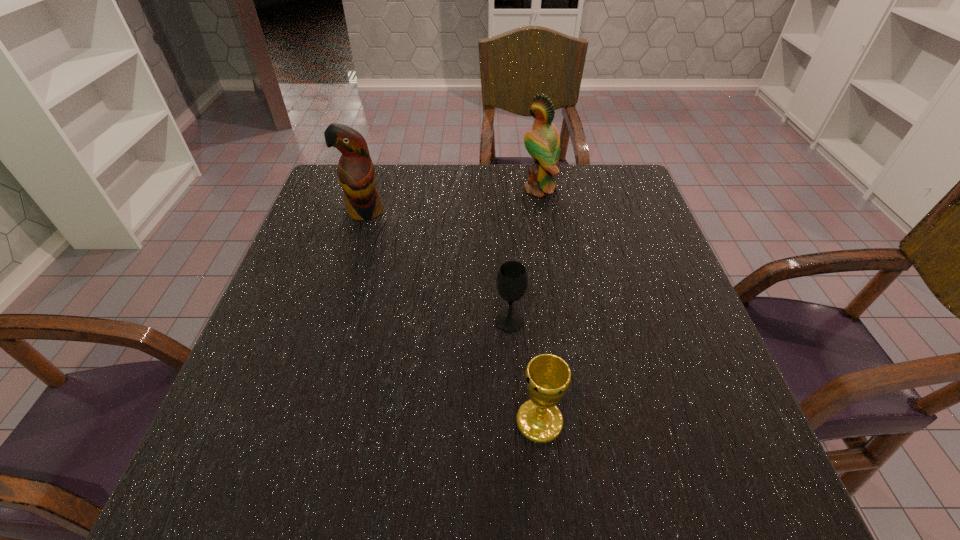
Find the location of a particular element. This screenshot has width=960, height=540. object that is positioned at the left edge is located at coordinates (356, 174).

Where is `object present at the far left corner`? object present at the far left corner is located at coordinates (356, 174).

Image resolution: width=960 pixels, height=540 pixels. What are the coordinates of `blank space at the near edge` in the screenshot? It's located at (365, 464).

In the image, there is a desktop. Where is `vacant region at the left edge`? vacant region at the left edge is located at coordinates (293, 256).

Find the location of a particular element. The height and width of the screenshot is (540, 960). free space at the right edge is located at coordinates (692, 423).

The image size is (960, 540). In the image, there is a desktop. Find the location of `vacant area at the far left corner`. vacant area at the far left corner is located at coordinates (338, 192).

In the image, there is a desktop. At what (x,y) coordinates should I click in order to perform the action: click on vacant space at the far right corner. Please return your answer as a coordinate pair (x, y). Looking at the image, I should click on (642, 196).

In the image, there is a desktop. Where is `free region at the near right corner`? This screenshot has height=540, width=960. free region at the near right corner is located at coordinates (712, 478).

Locate an element on the screen. The width and height of the screenshot is (960, 540). vacant space that's between the right parrot and the left parrot is located at coordinates (452, 200).

This screenshot has width=960, height=540. I want to click on free spot between the third farthest object and the chalice, so click(524, 372).